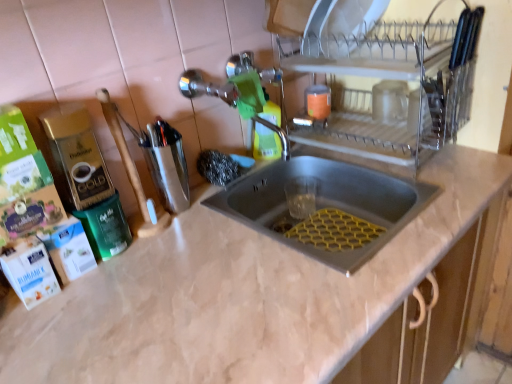
Question: Do you think beige marble countertop at center is within stainless steel sink at center, or outside of it?

Choices:
 (A) outside
 (B) inside

Answer: (A)

Question: From their relative heights in the image, would you say beige marble countertop at center is taller or shorter than stainless steel sink at center?

Choices:
 (A) tall
 (B) short

Answer: (A)

Question: Which object is positioned closest to the green matte bottle at center?

Choices:
 (A) clear glass dish rack at upper right, the first appliance viewed from the right
 (B) stainless steel sink at center
 (C) beige marble countertop at center
 (D) metallic silver utensil holder at center-left, acting as the second appliance starting from the right

Answer: (B)

Question: Which object is positioned farthest from the metallic silver utensil holder at center-left, acting as the second appliance starting from the right?

Choices:
 (A) green matte bottle at center
 (B) beige marble countertop at center
 (C) stainless steel sink at center
 (D) clear glass dish rack at upper right, which is the 2th appliance from left to right

Answer: (D)